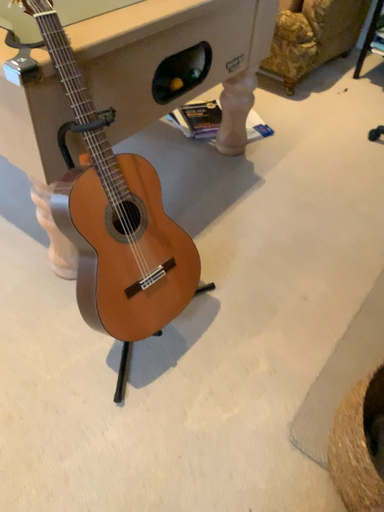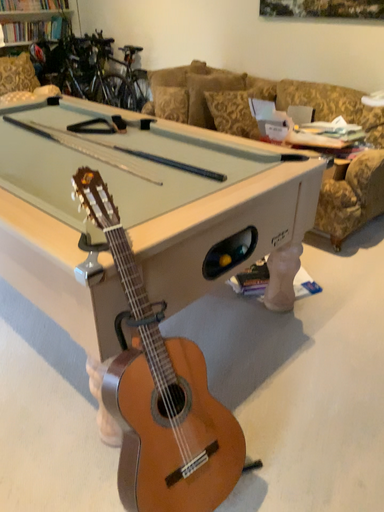
Question: How did the camera likely rotate when shooting the video?

Choices:
 (A) rotated downward
 (B) rotated upward

Answer: (B)